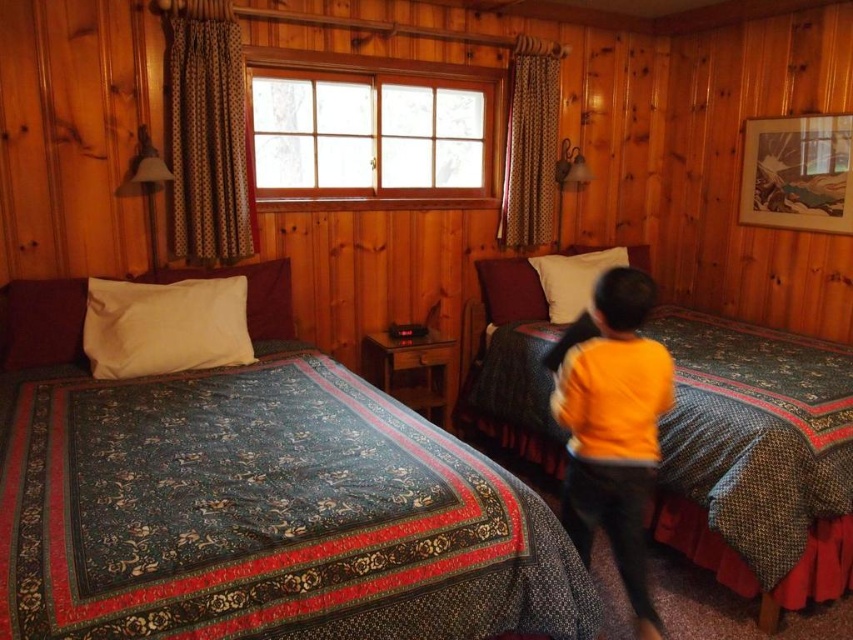
Is wooden window at center further to camera compared to orange sweater at center?

Yes, wooden window at center is further from the viewer.

Which is behind, point (363, 147) or point (556, 392)?

The point (363, 147) is more distant.

Find the location of `wooden window at center`. wooden window at center is located at coordinates (376, 122).

Measure the distance from wooden window at center to white soft pillow at left.

wooden window at center and white soft pillow at left are 3.38 feet apart.

Does point (260, 168) come closer to viewer compared to point (195, 310)?

No.

This screenshot has width=853, height=640. I want to click on wooden window at center, so click(x=376, y=122).

Locate an element on the screen. dark blue floral quilt at lower left is located at coordinates (267, 516).

Does dark blue floral quilt at lower left have a lesser width compared to wooden window at center?

No.

Which is in front, point (0, 564) or point (378, 116)?

Point (0, 564) is in front.

The width and height of the screenshot is (853, 640). Identify the location of dark blue floral quilt at lower left. (267, 516).